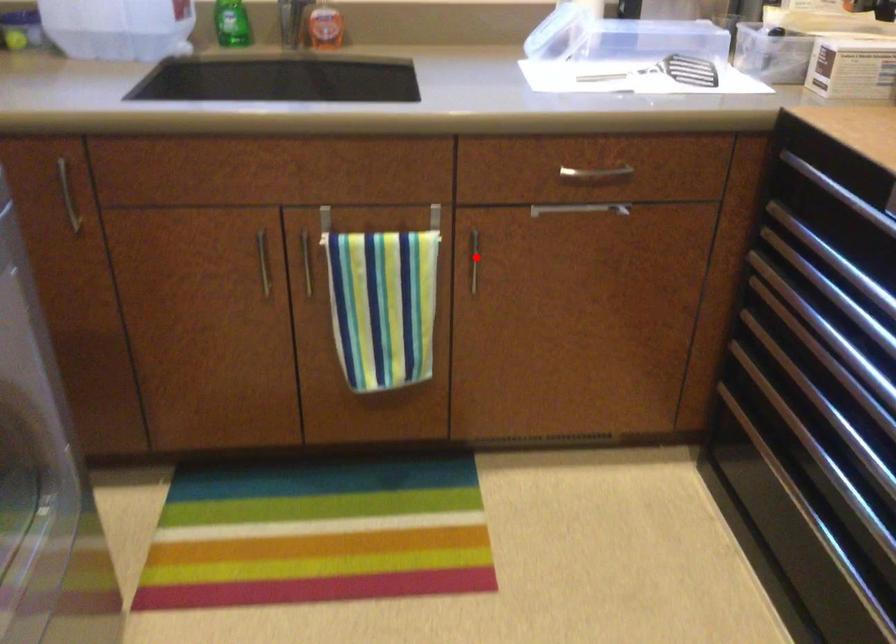
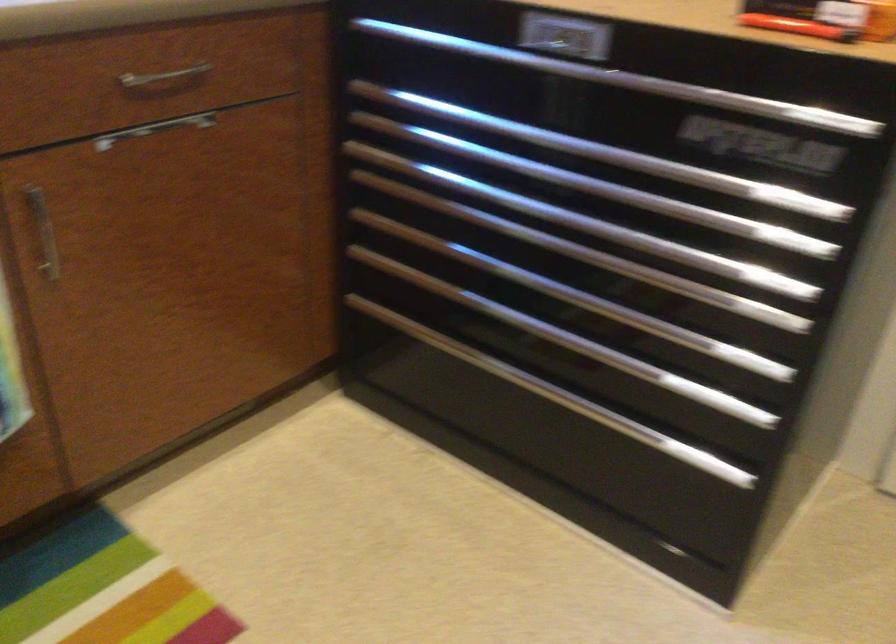
Question: I am providing you with two images of the same scene from different viewpoints. A red point is shown in image1. For the corresponding object point in image2, is it positioned nearer or farther from the camera?

Choices:
 (A) Nearer
 (B) Farther

Answer: (A)